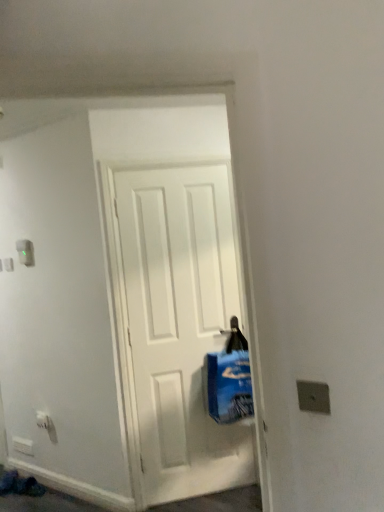
Question: Is white plastic light switch at upper left in front of or behind blue plastic bag at center in the image?

Choices:
 (A) behind
 (B) front

Answer: (A)

Question: Considering the positions of white plastic light switch at upper left and blue plastic bag at center in the image, is white plastic light switch at upper left wider or thinner than blue plastic bag at center?

Choices:
 (A) thin
 (B) wide

Answer: (A)

Question: Considering the real-world distances, which object is farthest from the white plastic electric outlet at lower left?

Choices:
 (A) white plastic light switch at upper left
 (B) blue plastic bag at center

Answer: (B)

Question: Which object is the farthest from the white plastic light switch at upper left?

Choices:
 (A) blue plastic bag at center
 (B) white plastic electric outlet at lower left

Answer: (A)